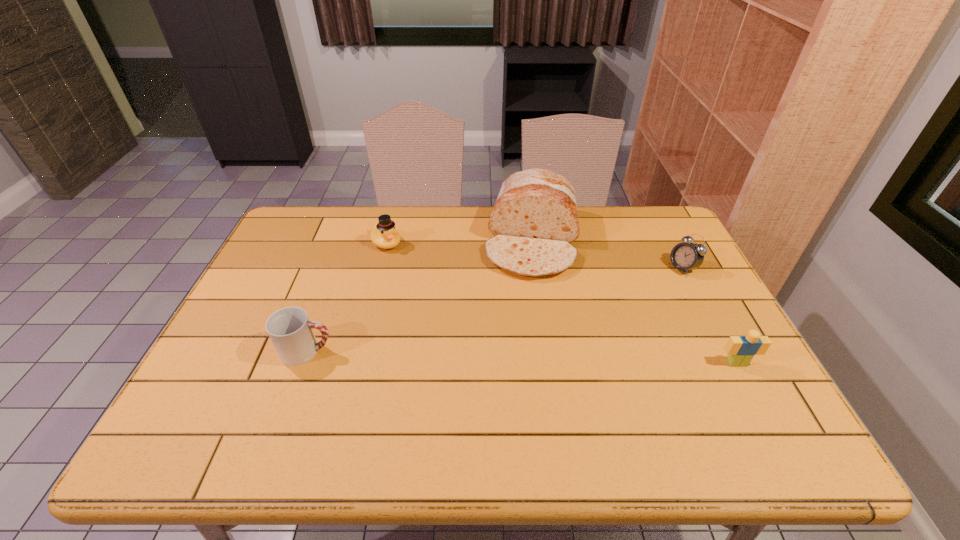
I want to click on free space located at the sliced end of the tallest object, so click(520, 361).

In order to click on free space located on the front-facing side of the second object from left to right in this screenshot , I will do `click(402, 261)`.

Locate an element on the screen. The height and width of the screenshot is (540, 960). vacant space located on the front-facing side of the second object from left to right is located at coordinates (452, 315).

Where is `free spot located on the front-facing side of the second object from left to right`? Image resolution: width=960 pixels, height=540 pixels. free spot located on the front-facing side of the second object from left to right is located at coordinates (445, 309).

Image resolution: width=960 pixels, height=540 pixels. Find the location of `vacant space located 0.230m on the face of the alarm clock`. vacant space located 0.230m on the face of the alarm clock is located at coordinates (615, 300).

Identify the location of free spot located 0.050m on the face of the alarm clock. Image resolution: width=960 pixels, height=540 pixels. (661, 279).

This screenshot has width=960, height=540. Identify the location of free space located 0.160m on the face of the alarm clock. (634, 291).

Identify the location of bread that is at the far edge. click(x=534, y=220).

I want to click on duck at the far edge, so click(384, 235).

Where is `Lego positioned at the right edge`? This screenshot has width=960, height=540. Lego positioned at the right edge is located at coordinates (741, 350).